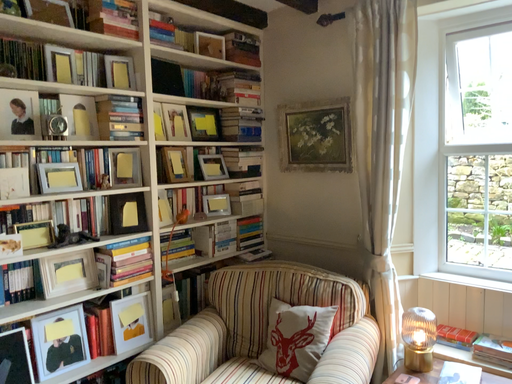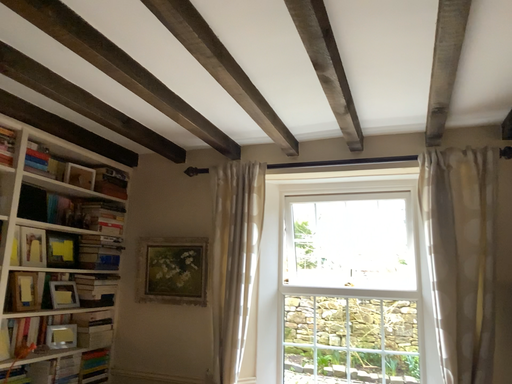
Question: How did the camera likely rotate when shooting the video?

Choices:
 (A) rotated left
 (B) rotated right

Answer: (B)